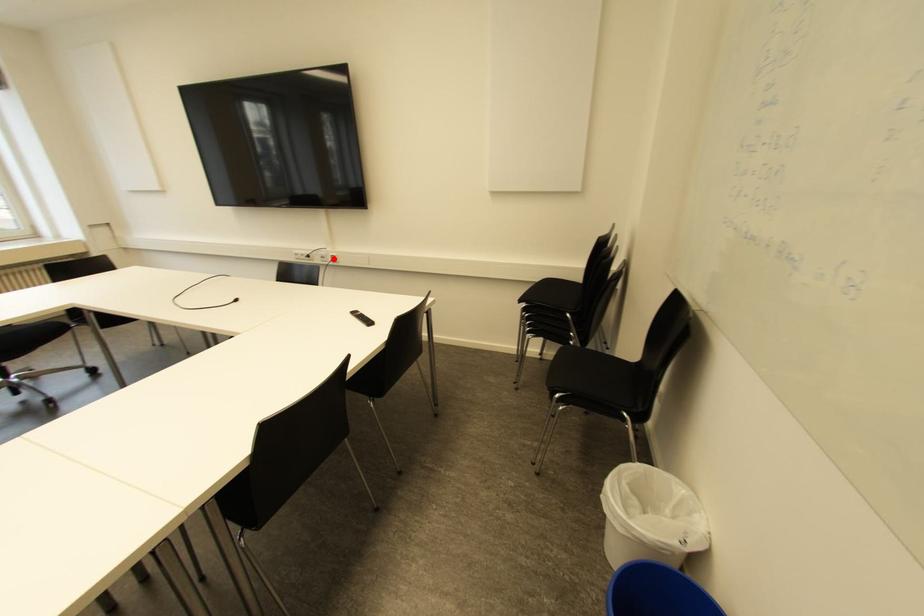
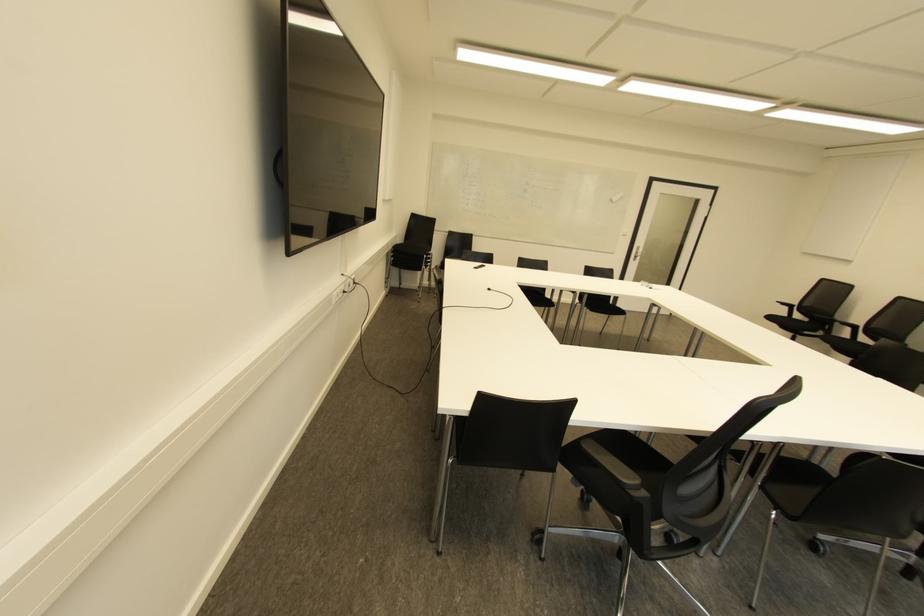
Question: I am providing you with two images of the same scene from different viewpoints. In image1, a red point is highlighted. Considering the same 3D point in image2, which of the following is correct?

Choices:
 (A) It is closer
 (B) It is farther

Answer: (A)